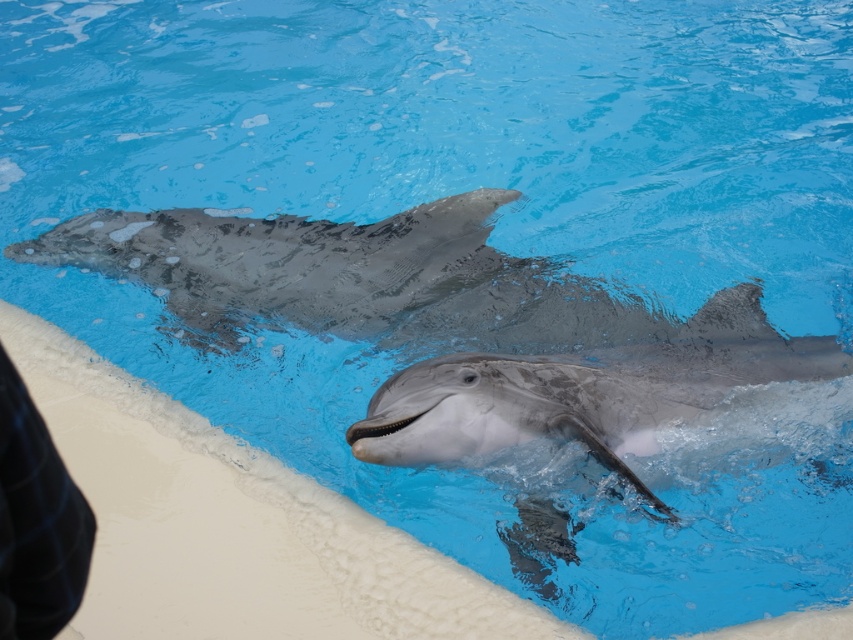
Does smooth gray dolphin at center have a smaller size compared to black checkered fabric at lower left?

Incorrect, smooth gray dolphin at center is not smaller in size than black checkered fabric at lower left.

Is smooth gray dolphin at center to the left of black checkered fabric at lower left from the viewer's perspective?

No, smooth gray dolphin at center is not to the left of black checkered fabric at lower left.

This screenshot has height=640, width=853. Describe the element at coordinates (596, 394) in the screenshot. I see `smooth gray dolphin at center` at that location.

Identify the location of smooth gray dolphin at center. The image size is (853, 640). (596, 394).